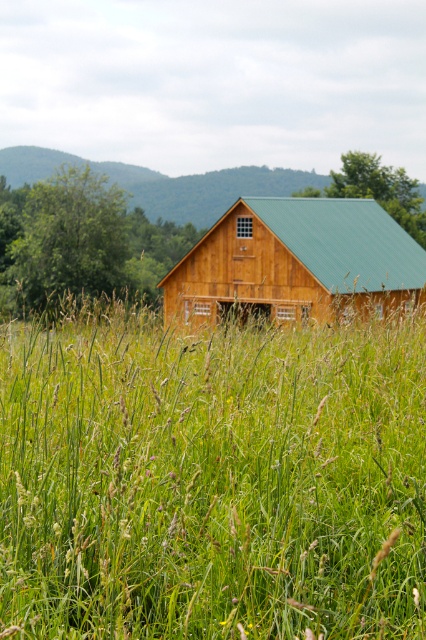
You are standing at the point marked as point (210,477) in the image. What do you see directly beneath your feet?

You see green grass at center directly beneath your feet at point (210,477).

Based on the photo, you are standing at the entrance of the rustic wooden barn and want to place a decorative stone exactly at the center of the green grass at center. According to the image, what are the coordinates where you should place the stone?

The coordinates for the green grass at center are at point (x=210, y=477), so you should place the decorative stone at those coordinates.

You are a farmer standing in the field and want to determine which object is larger between the green grass at center and the wooden barn at center. Based on the scene, which one is bigger?

The wooden barn at center is larger than the green grass at center.